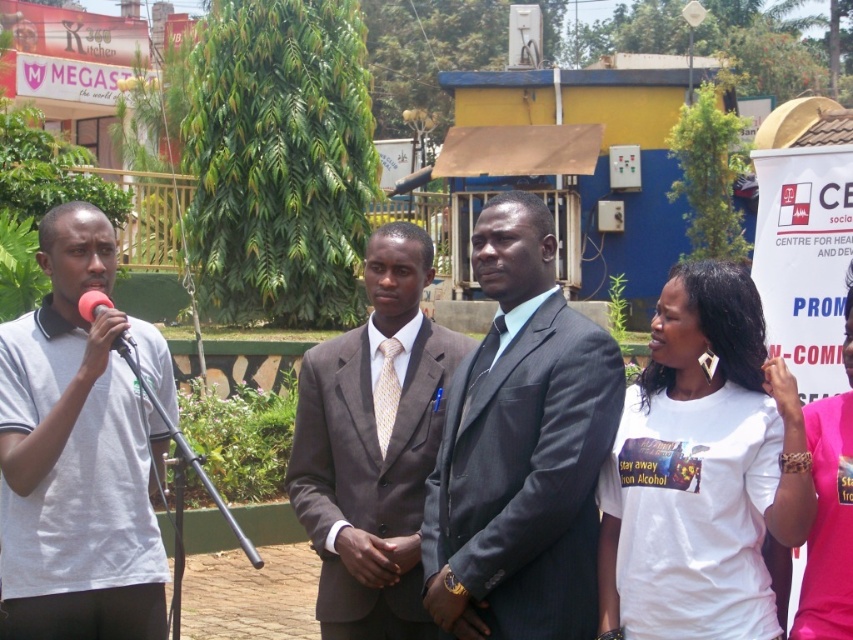
Is point (566, 381) closer to viewer compared to point (827, 467)?

No, it is not.

Image resolution: width=853 pixels, height=640 pixels. In order to click on dark gray pinstripe suit at center in this screenshot , I will do `click(521, 449)`.

What do you see at coordinates (521, 449) in the screenshot? This screenshot has width=853, height=640. I see `dark gray pinstripe suit at center` at bounding box center [521, 449].

This screenshot has height=640, width=853. What are the coordinates of `dark gray pinstripe suit at center` in the screenshot? It's located at (521, 449).

Does dark gray pinstripe suit at center appear under brown suit at center?

Actually, dark gray pinstripe suit at center is above brown suit at center.

The height and width of the screenshot is (640, 853). Describe the element at coordinates (521, 449) in the screenshot. I see `dark gray pinstripe suit at center` at that location.

The width and height of the screenshot is (853, 640). I want to click on dark gray pinstripe suit at center, so click(521, 449).

Which is behind, point (712, 481) or point (115, 348)?

Point (115, 348)

Identify the location of white matte t-shirt at right. Image resolution: width=853 pixels, height=640 pixels. (701, 468).

Who is more forward, (656,342) or (117,346)?

Point (656,342) is in front.

This screenshot has height=640, width=853. What are the coordinates of `white matte t-shirt at right` in the screenshot? It's located at (701, 468).